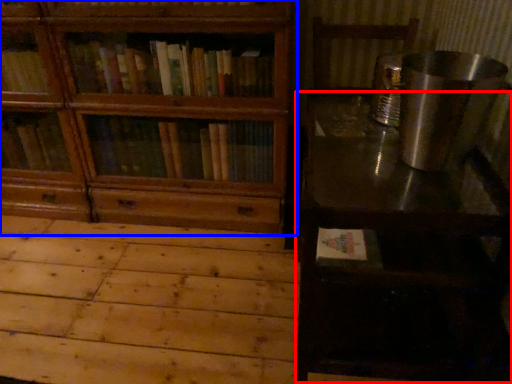
Question: Which of the following is the closest to the observer, table (highlighted by a red box) or bookcase (highlighted by a blue box)?

Choices:
 (A) table
 (B) bookcase

Answer: (A)